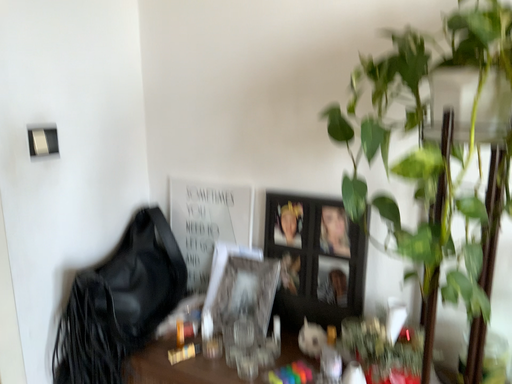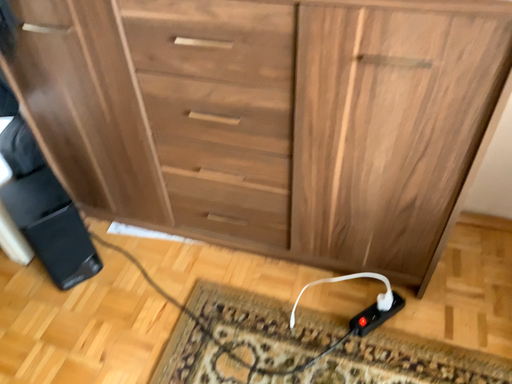
Question: Which way did the camera rotate in the video?

Choices:
 (A) rotated right
 (B) rotated left

Answer: (A)